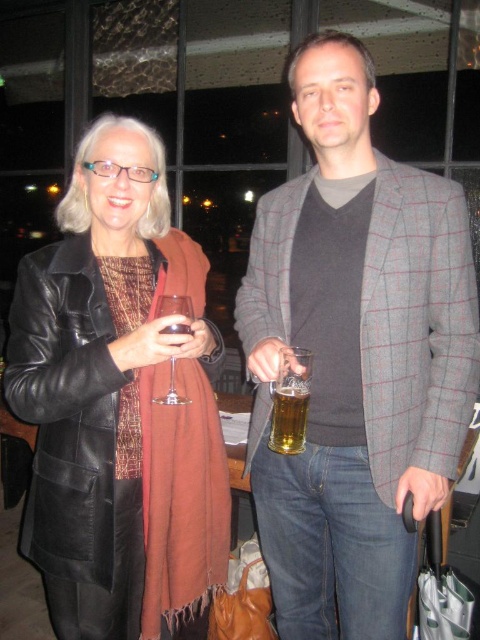
Can you confirm if gray checkered blazer at center is bigger than translucent glass beer at center?

Indeed, gray checkered blazer at center has a larger size compared to translucent glass beer at center.

Can you confirm if gray checkered blazer at center is positioned below translucent glass beer at center?

No.

What are the coordinates of `gray checkered blazer at center` in the screenshot? It's located at pos(356,355).

Between gray checkered blazer at center and leather jacket at left, which one is positioned higher?

Positioned higher is gray checkered blazer at center.

Does gray checkered blazer at center appear on the left side of leather jacket at left?

In fact, gray checkered blazer at center is to the right of leather jacket at left.

Is point (363, 276) farther from viewer compared to point (206, 408)?

No, it is in front of (206, 408).

Locate an element on the screen. gray checkered blazer at center is located at coordinates (356, 355).

How distant is leather jacket at left from transparent glass at center?

leather jacket at left is 9.46 inches away from transparent glass at center.

This screenshot has width=480, height=640. What do you see at coordinates (113, 397) in the screenshot? I see `leather jacket at left` at bounding box center [113, 397].

Identify the location of leather jacket at left. The height and width of the screenshot is (640, 480). (113, 397).